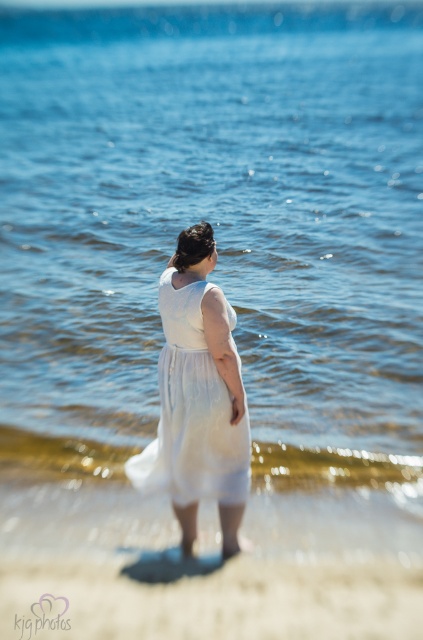
You are a photographer aiming to capture the woman in the white sheer dress at center. To ensure the white sand at lower center is visible in the reflection of the water, where should you position yourself relative to the dress?

You should position yourself so that the white sand at lower center is below the white sheer dress at center in the frame, as the sand is located below the dress.

You are a photographer trying to capture the woman in the scene. The white sand at lower center is at point 0.938, 0.496. Can you determine the direction you should move to get a better shot of the woman?

The white sand at lower center is at point (209, 600). Since the woman is standing near the shoreline facing away from the camera, moving towards the white sand at lower center would position you closer to her feet, potentially allowing for a better composition focusing on her silhouette against the water.